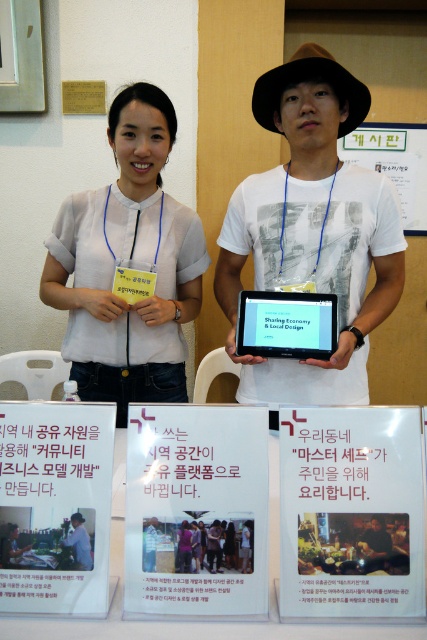
You are organizing a small conference and need to ensure that the green paper at upper center and the light blue shirt at center are visible to all attendees. Considering their sizes, which one would be more easily seen from the back of the room?

The green paper at upper center has a larger size compared to the light blue shirt at center, so it would be more easily seen from the back of the room.

You are an event organizer and need to adjust the setup so that the light blue shirt at center is positioned to the left of the green paper at upper center. Based on the current arrangement, is this possible without moving the table?

The green paper at upper center is currently to the right of the light blue shirt at center. To move the light blue shirt at center to the left of the green paper at upper center, you would need to shift the light blue shirt at center to the left side of the green paper at upper center. However, since the table is fixed in position, moving the light blue shirt at center might require adjusting the placement of other items on the table or repositioning the individuals, but the table itself cannot be moved.